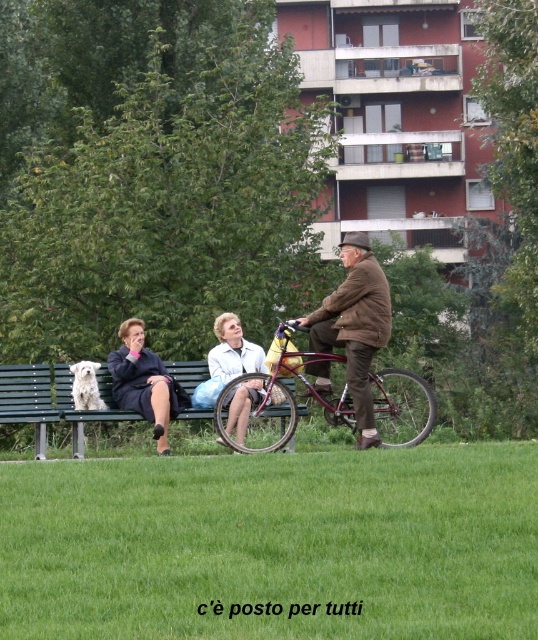
You are a photographer trying to capture a candid shot of the two women on the green park bench. You want to ensure that the matte black jacket at center and the dark blue fabric coat at center are both in focus. Which jacket should you focus on first if you want to start with the one closer to the left side?

The matte black jacket at center is positioned on the left side of dark blue fabric coat at center, so you should focus on the matte black jacket at center first as it is closer to the left side.

You are a photographer trying to capture a candid shot of the two women on the green park bench. You notice the matte black jacket at center and the dark blue fabric coat at center. Which clothing item is closer to the camera?

The matte black jacket at center is closer to the camera because the dark blue fabric coat at center is behind it.